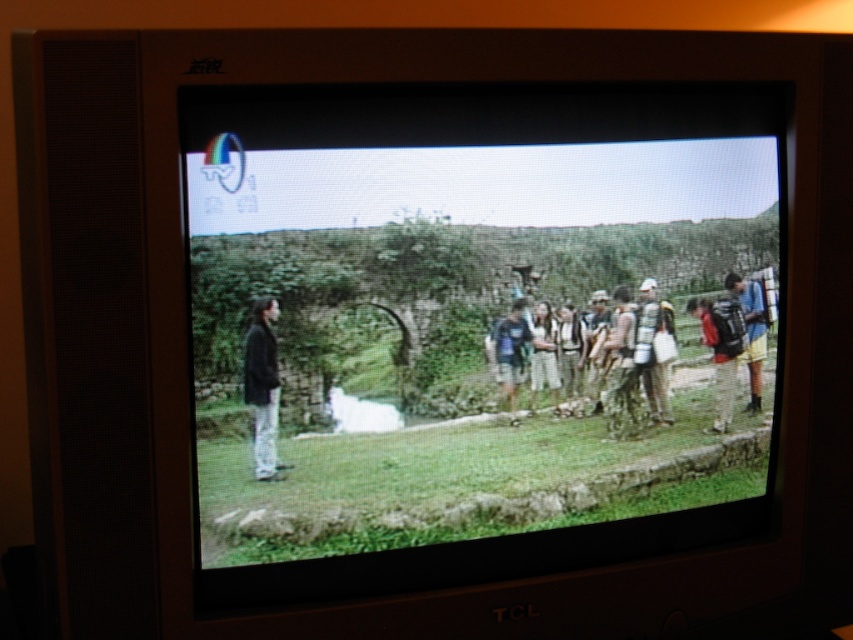
Does green grass at center have a greater width compared to dark blue fabric backpack at center?

Correct, the width of green grass at center exceeds that of dark blue fabric backpack at center.

This screenshot has height=640, width=853. In order to click on green grass at center in this screenshot , I will do `click(469, 307)`.

Which is in front, point (373, 317) or point (523, 340)?

Positioned in front is point (373, 317).

Where is `green grass at center`? green grass at center is located at coordinates (469, 307).

Does camouflage fabric backpack at center-right lie behind light brown leather jacket at center?

Yes, it is.

Can you confirm if camouflage fabric backpack at center-right is positioned to the left of light brown leather jacket at center?

Incorrect, camouflage fabric backpack at center-right is not on the left side of light brown leather jacket at center.

Which is behind, point (616, 300) or point (543, 305)?

The point (616, 300) is behind.

Where is `camouflage fabric backpack at center-right`? This screenshot has width=853, height=640. camouflage fabric backpack at center-right is located at coordinates (622, 369).

Based on the photo, does blue fabric backpack at right have a smaller size compared to camouflage fabric backpack at center?

Actually, blue fabric backpack at right might be larger than camouflage fabric backpack at center.

Does blue fabric backpack at right have a greater width compared to camouflage fabric backpack at center?

Indeed, blue fabric backpack at right has a greater width compared to camouflage fabric backpack at center.

Describe the element at coordinates (751, 330) in the screenshot. I see `blue fabric backpack at right` at that location.

I want to click on blue fabric backpack at right, so click(x=751, y=330).